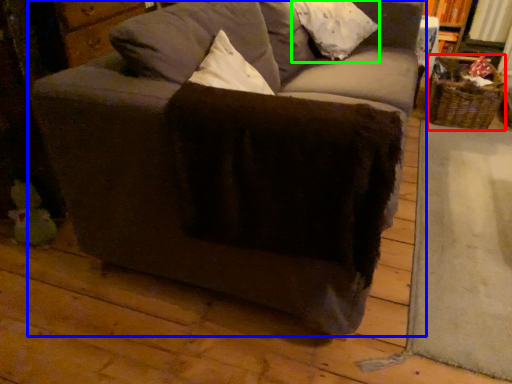
Question: Which is farther away from basket (highlighted by a red box)? studio couch (highlighted by a blue box) or pillow (highlighted by a green box)?

Choices:
 (A) studio couch
 (B) pillow

Answer: (A)